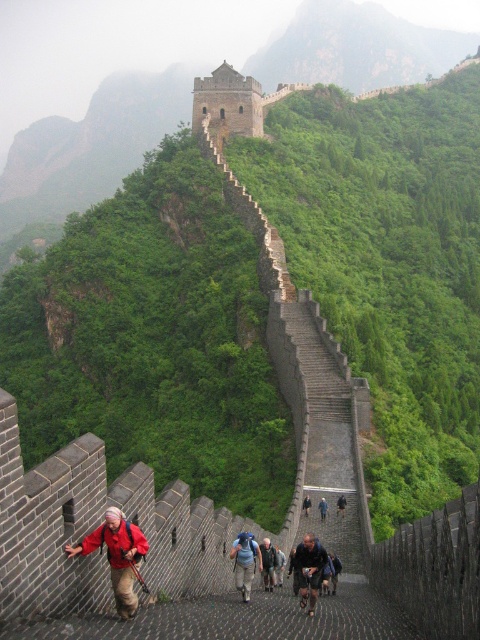
Measure the distance between dark gray fabric backpack at center and dark blue backpack at center.

dark gray fabric backpack at center is 8.32 feet from dark blue backpack at center.

Based on the photo, does dark gray fabric backpack at center appear under dark blue backpack at center?

Actually, dark gray fabric backpack at center is above dark blue backpack at center.

Is point (342, 506) farther from viewer compared to point (304, 508)?

No.

Where is `dark gray fabric backpack at center`? This screenshot has width=480, height=640. dark gray fabric backpack at center is located at coordinates (340, 504).

Does denim pants at center appear over dark blue backpack at center?

Indeed, denim pants at center is positioned over dark blue backpack at center.

Is point (242, 540) closer to viewer compared to point (308, 508)?

Yes, point (242, 540) is in front of point (308, 508).

Image resolution: width=480 pixels, height=640 pixels. Find the location of `denim pants at center`. denim pants at center is located at coordinates (244, 561).

Who is more distant from viewer, (304, 576) or (320, 508)?

The point (320, 508) is more distant.

Find the location of a particular element. The height and width of the screenshot is (640, 480). dark blue fabric backpack at center is located at coordinates (309, 570).